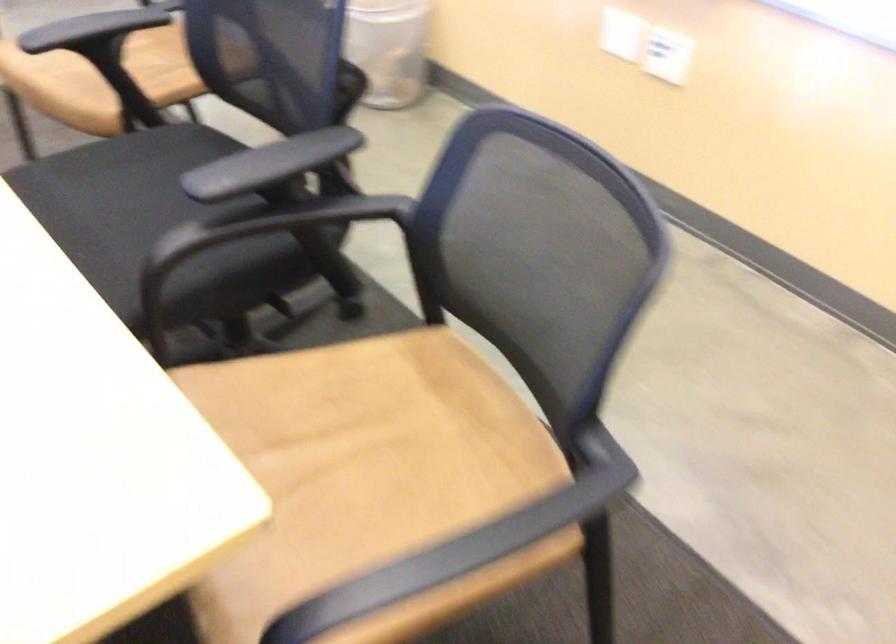
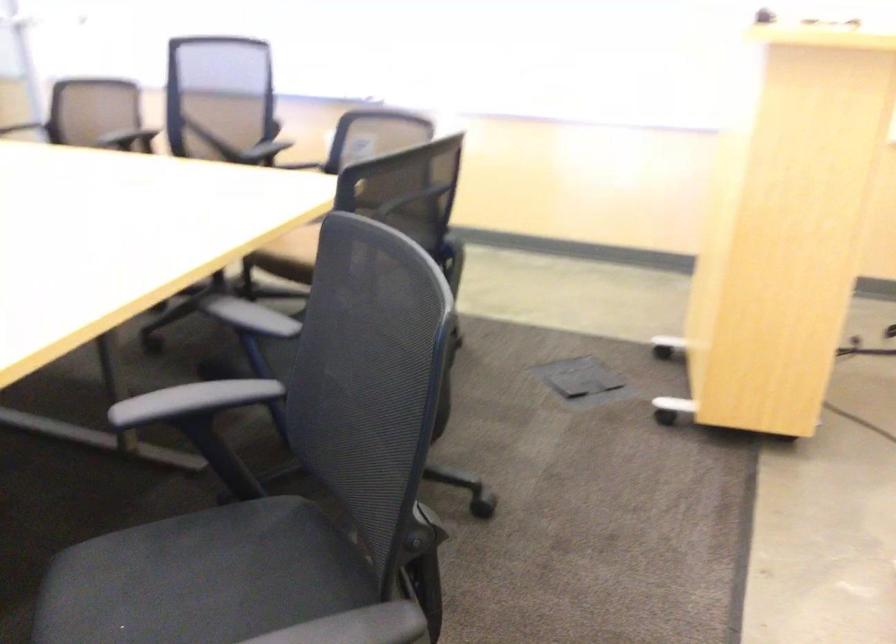
Question: I am providing you with two images of the same scene from different viewpoints. After the viewpoint changes to image2, which objects are now occluded?

Choices:
 (A) black chair armrest
 (B) black chair sitting surface
 (C) blue beanbag chair
 (D) brown chair sitting surface

Answer: (A)